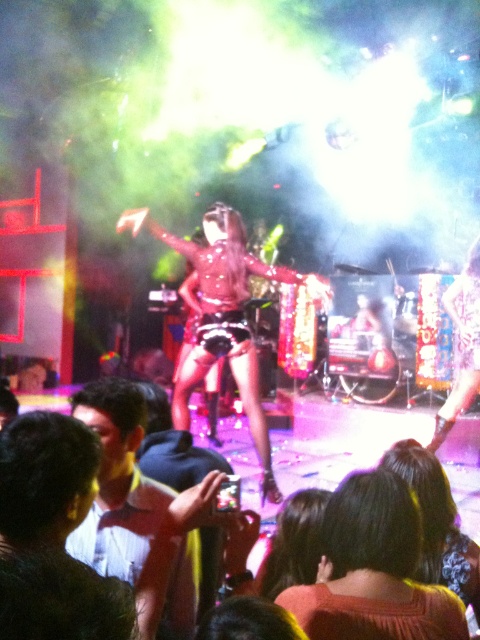
Question: Which of the following is the closest to the observer?

Choices:
 (A) (93, 428)
 (B) (348, 564)
 (C) (223, 349)

Answer: (B)

Question: Is white glossy shirt at lower left to the right of shiny metallic outfit at center from the viewer's perspective?

Choices:
 (A) no
 (B) yes

Answer: (A)

Question: Which of the following is the farthest from the observer?

Choices:
 (A) shiny metallic outfit at center
 (B) white glossy shirt at lower left

Answer: (A)

Question: Which point is closer to the camera taking this photo?

Choices:
 (A) (177, 611)
 (B) (365, 516)

Answer: (B)

Question: Can you confirm if white glossy shirt at lower left is thinner than shiny metallic outfit at center?

Choices:
 (A) no
 (B) yes

Answer: (B)

Question: Where is brown textured sweater at lower center located in relation to white glossy shirt at lower left in the image?

Choices:
 (A) left
 (B) right

Answer: (B)